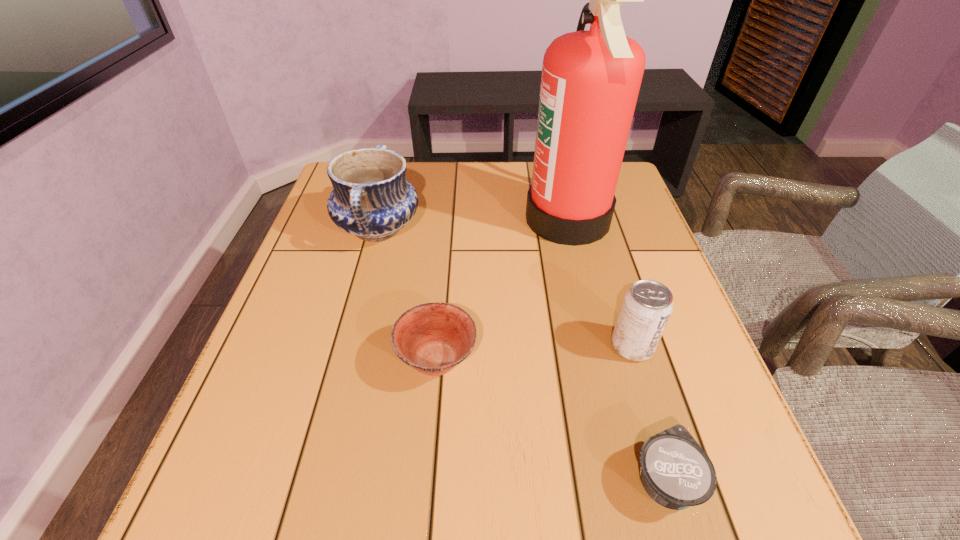
Find the location of a particular element. The image size is (960, 540). object located in the far left corner section of the desktop is located at coordinates (371, 198).

The height and width of the screenshot is (540, 960). I want to click on object that is at the far right corner, so click(590, 82).

Where is `object situated at the near right corner`? The width and height of the screenshot is (960, 540). object situated at the near right corner is located at coordinates (675, 471).

The width and height of the screenshot is (960, 540). I want to click on vacant area at the near edge, so coord(640,525).

Where is `vacant space at the left edge`? This screenshot has height=540, width=960. vacant space at the left edge is located at coordinates (351, 291).

The height and width of the screenshot is (540, 960). I want to click on free space at the near left corner of the desktop, so click(232, 496).

The height and width of the screenshot is (540, 960). Find the location of `vacant space at the near right corner of the desktop`. vacant space at the near right corner of the desktop is located at coordinates (666, 534).

This screenshot has width=960, height=540. I want to click on vacant space that is in between the pottery and the fire extinguisher, so click(473, 224).

I want to click on empty location between the soda can and the shortest object, so click(x=648, y=413).

Where is `free space between the soda can and the bowl`? The image size is (960, 540). free space between the soda can and the bowl is located at coordinates (535, 353).